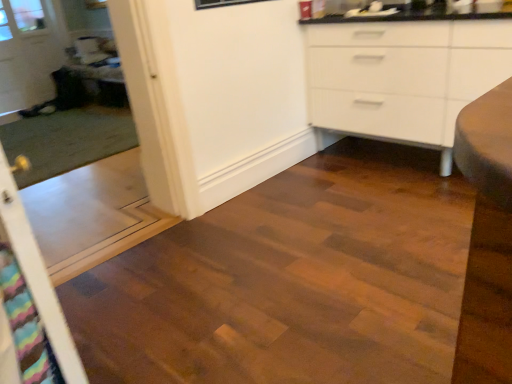
Question: Considering the positions of transparent glass door at upper left and multicolored fabric screen door at left, which is the first screen door from front to back, in the image, is transparent glass door at upper left wider or thinner than multicolored fabric screen door at left, which is the first screen door from front to back,?

Choices:
 (A) wide
 (B) thin

Answer: (B)

Question: Relative to multicolored fabric screen door at left, which is the first screen door from front to back, is transparent glass door at upper left in front or behind?

Choices:
 (A) front
 (B) behind

Answer: (B)

Question: Based on their relative distances, which object is farther from the transparent plastic screen door at left, the 2th screen door from the front?

Choices:
 (A) wooden table at left
 (B) transparent glass door at upper left
 (C) multicolored fabric screen door at left, acting as the 2th screen door starting from the back

Answer: (C)

Question: Considering the real-world distances, which object is farthest from the transparent glass door at upper left?

Choices:
 (A) wooden table at left
 (B) multicolored fabric screen door at left, acting as the 2th screen door starting from the back
 (C) transparent plastic screen door at left, the 2th screen door from the front

Answer: (B)